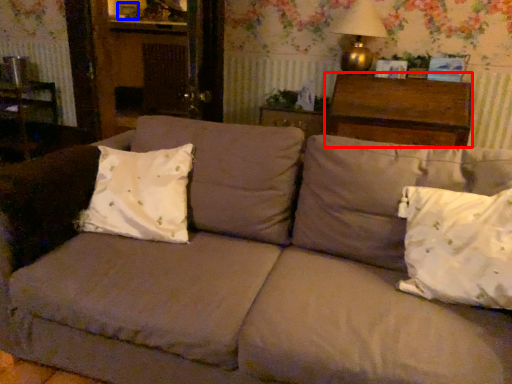
Question: Which object is closer to the camera taking this photo, hardwood (highlighted by a red box) or picture frame (highlighted by a blue box)?

Choices:
 (A) hardwood
 (B) picture frame

Answer: (A)